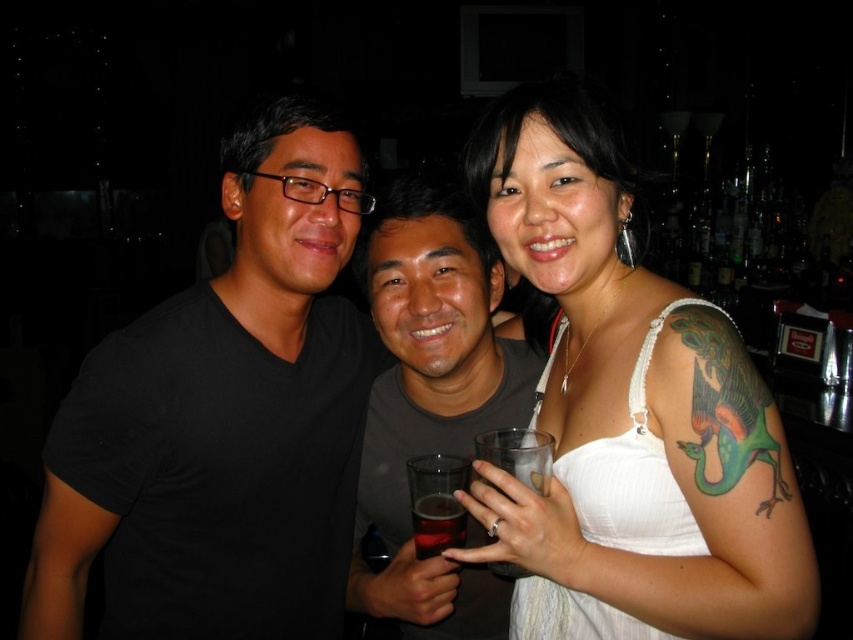
Question: Can you confirm if white fabric dress at center is thinner than dark gray t-shirt at center?

Choices:
 (A) no
 (B) yes

Answer: (A)

Question: Which object is positioned farthest from the black matte t-shirt at left?

Choices:
 (A) dark gray t-shirt at center
 (B) translucent glass at center

Answer: (B)

Question: Does dark gray t-shirt at center have a lesser width compared to translucent glass at center?

Choices:
 (A) yes
 (B) no

Answer: (B)

Question: Estimate the real-world distances between objects in this image. Which object is farther from the translucent glass at center?

Choices:
 (A) black matte t-shirt at left
 (B) white fabric dress at center

Answer: (A)

Question: Does black matte t-shirt at left come behind dark gray t-shirt at center?

Choices:
 (A) yes
 (B) no

Answer: (A)

Question: Which point appears farthest from the camera in this image?

Choices:
 (A) (56, 611)
 (B) (670, 340)
 (C) (431, 310)
 (D) (444, 508)

Answer: (C)